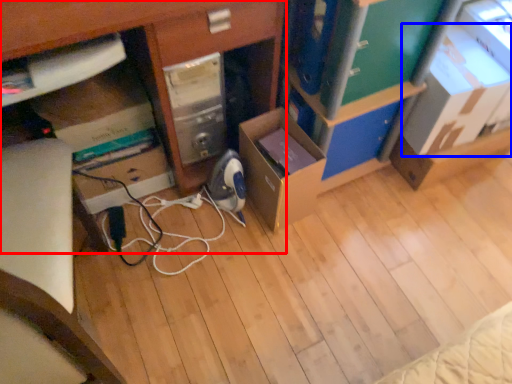
Question: Which of the following is the closest to the observer, desk (highlighted by a red box) or cardboard box (highlighted by a blue box)?

Choices:
 (A) desk
 (B) cardboard box

Answer: (A)